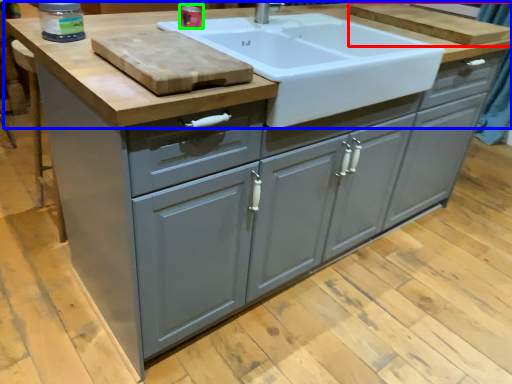
Question: Which is nearer to the cutting board (highlighted by a red box)? countertop (highlighted by a blue box) or appliance (highlighted by a green box).

Choices:
 (A) countertop
 (B) appliance

Answer: (A)